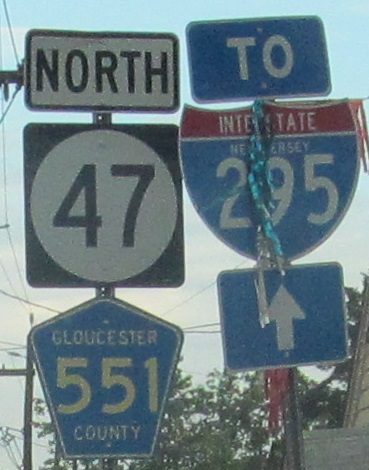
At what (x,y) coordinates should I click in order to perform the action: click on electrical wires. Please return your answer as a coordinate pair (x, y). Image resolution: width=369 pixels, height=470 pixels. Looking at the image, I should click on (194, 294), (209, 324), (210, 330).